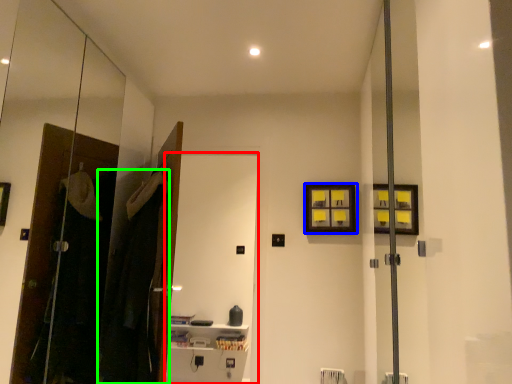
Question: Estimate the real-world distances between objects in this image. Which object is farther from screen door (highlighted by a red box), picture frame (highlighted by a blue box) or laundry (highlighted by a green box)?

Choices:
 (A) picture frame
 (B) laundry

Answer: (B)